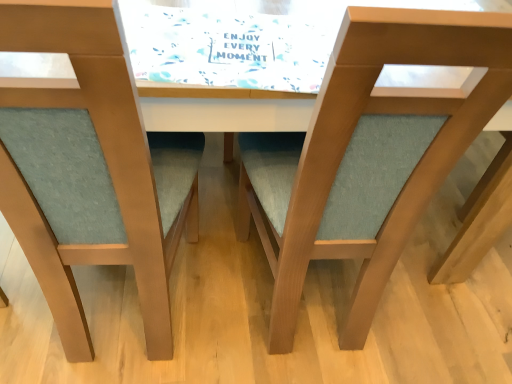
Question: Which direction should I rotate to look at matte wood chair at center, arranged as the second chair when viewed from the left, — up or down?

Choices:
 (A) down
 (B) up

Answer: (B)

Question: Which direction should I rotate to face matte wood chair at center, positioned as the first chair in left-to-right order, — up or down?

Choices:
 (A) down
 (B) up

Answer: (B)

Question: Is matte wood chair at center, acting as the 1th chair starting from the right, further to camera compared to matte wood chair at center, positioned as the first chair in left-to-right order?

Choices:
 (A) no
 (B) yes

Answer: (B)

Question: Are matte wood chair at center, acting as the 1th chair starting from the right, and matte wood chair at center, positioned as the first chair in left-to-right order, located far from each other?

Choices:
 (A) no
 (B) yes

Answer: (A)

Question: Does matte wood chair at center, arranged as the second chair when viewed from the left, have a greater width compared to matte wood chair at center, positioned as the 2th chair in right-to-left order?

Choices:
 (A) yes
 (B) no

Answer: (B)

Question: Does matte wood chair at center, arranged as the second chair when viewed from the left, have a larger size compared to matte wood chair at center, positioned as the 2th chair in right-to-left order?

Choices:
 (A) yes
 (B) no

Answer: (B)

Question: From the image's perspective, is matte wood chair at center, acting as the 1th chair starting from the right, beneath matte wood chair at center, positioned as the first chair in left-to-right order?

Choices:
 (A) no
 (B) yes

Answer: (B)

Question: Is matte wood chair at center, arranged as the second chair when viewed from the left, positioned beyond the bounds of matte wood chair at center, positioned as the first chair in left-to-right order?

Choices:
 (A) no
 (B) yes

Answer: (B)

Question: Does matte wood chair at center, positioned as the first chair in left-to-right order, have a greater width compared to matte wood chair at center, arranged as the second chair when viewed from the left?

Choices:
 (A) yes
 (B) no

Answer: (A)

Question: Can you confirm if matte wood chair at center, positioned as the first chair in left-to-right order, is smaller than matte wood chair at center, arranged as the second chair when viewed from the left?

Choices:
 (A) no
 (B) yes

Answer: (A)

Question: Is matte wood chair at center, positioned as the 2th chair in right-to-left order, oriented away from matte wood chair at center, acting as the 1th chair starting from the right?

Choices:
 (A) yes
 (B) no

Answer: (B)

Question: Would you say matte wood chair at center, arranged as the second chair when viewed from the left, is part of matte wood chair at center, positioned as the first chair in left-to-right order,'s contents?

Choices:
 (A) no
 (B) yes

Answer: (A)

Question: Is matte wood chair at center, positioned as the first chair in left-to-right order, far away from matte wood chair at center, acting as the 1th chair starting from the right?

Choices:
 (A) yes
 (B) no

Answer: (B)

Question: Could you tell me if matte wood chair at center, positioned as the first chair in left-to-right order, is turned towards matte wood chair at center, acting as the 1th chair starting from the right?

Choices:
 (A) yes
 (B) no

Answer: (B)

Question: Is matte wood chair at center, arranged as the second chair when viewed from the left, to the left or to the right of matte wood chair at center, positioned as the first chair in left-to-right order, in the image?

Choices:
 (A) left
 (B) right

Answer: (B)